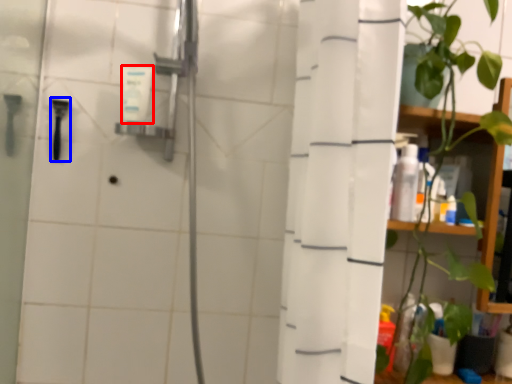
Question: Which object is further to the camera taking this photo, toiletry (highlighted by a red box) or shower (highlighted by a blue box)?

Choices:
 (A) toiletry
 (B) shower

Answer: (B)